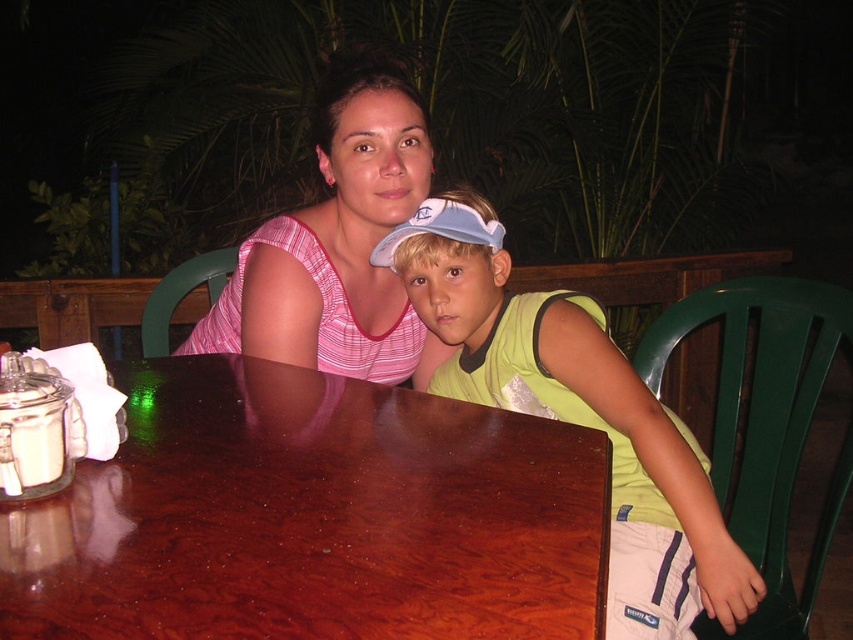
Question: Which point is farther to the camera?

Choices:
 (A) light blue fabric baseball cap at center
 (B) pink striped tank top at center

Answer: (B)

Question: Is mahogany wood table at center behind green fabric shirt at center?

Choices:
 (A) no
 (B) yes

Answer: (A)

Question: Which point is closer to the camera?

Choices:
 (A) (461, 202)
 (B) (161, 572)

Answer: (B)

Question: Estimate the real-world distances between objects in this image. Which object is farther from the light blue fabric baseball cap at center?

Choices:
 (A) green fabric shirt at center
 (B) mahogany wood table at center
 (C) pink striped tank top at center

Answer: (B)

Question: Is mahogany wood table at center closer to the viewer compared to green fabric shirt at center?

Choices:
 (A) no
 (B) yes

Answer: (B)

Question: In this image, where is green fabric shirt at center located relative to light blue fabric baseball cap at center?

Choices:
 (A) left
 (B) right

Answer: (B)